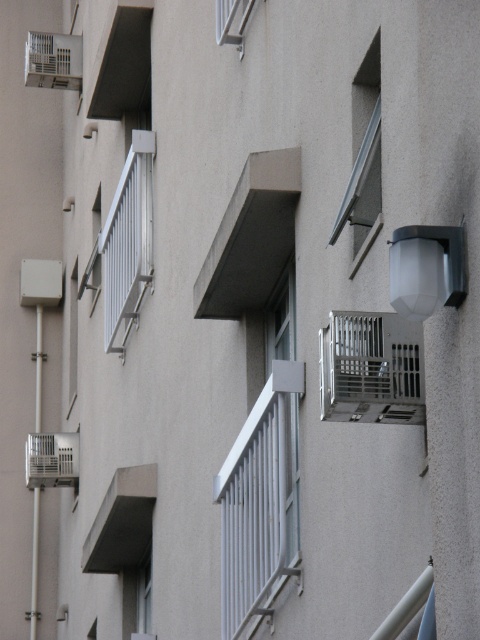
Is white plastic balcony at lower left wider than matte white window at upper center?

Yes, white plastic balcony at lower left is wider than matte white window at upper center.

At what (x,y) coordinates should I click in order to perform the action: click on white plastic balcony at lower left. Please return your answer as a coordinate pair (x, y). The width and height of the screenshot is (480, 640). Looking at the image, I should click on (51, 460).

Is point (337, 337) in front of point (352, 228)?

Yes.

Between point (372, 406) and point (349, 198), which one is positioned in front?

Positioned in front is point (372, 406).

This screenshot has height=640, width=480. Identify the location of metallic silver air conditioner at right. (371, 369).

Does white metal balcony at upper left have a greater width compared to white matte window at center?

Yes, white metal balcony at upper left is wider than white matte window at center.

From the picture: Is white metal balcony at upper left behind white matte window at center?

That is True.

Which is in front, point (72, 51) or point (288, 262)?

Positioned in front is point (288, 262).

This screenshot has height=640, width=480. In order to click on white metal balcony at upper left in this screenshot , I will do `click(54, 60)`.